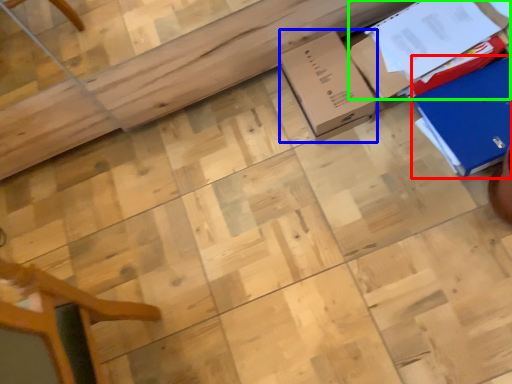
Question: Considering the real-world distances, which object is closest to cardboard box (highlighted by a red box)? cardboard box (highlighted by a blue box) or cardboard box (highlighted by a green box).

Choices:
 (A) cardboard box
 (B) cardboard box

Answer: (B)